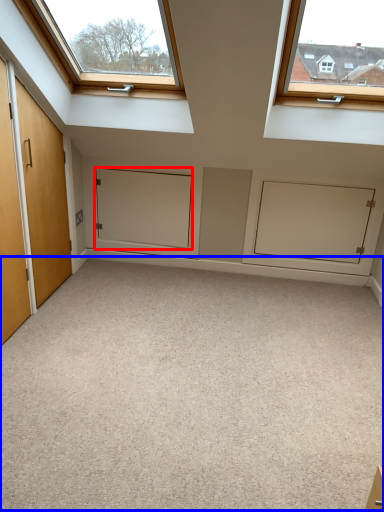
Question: Among these objects, which one is nearest to the camera, door (highlighted by a red box) or plain (highlighted by a blue box)?

Choices:
 (A) door
 (B) plain

Answer: (B)